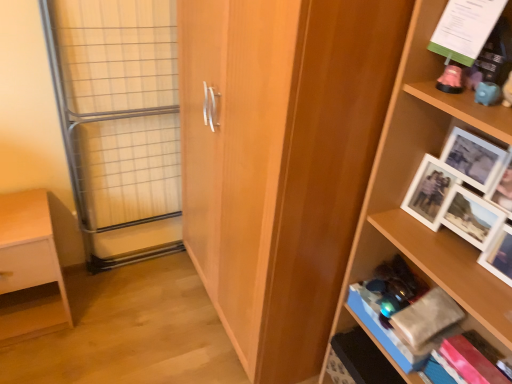
Question: From a real-world perspective, is white matte wooden shelf at lower left, acting as the first shelf starting from the left, located higher than clear glass door at left?

Choices:
 (A) no
 (B) yes

Answer: (A)

Question: Considering the relative positions of white matte wooden shelf at lower left, which is counted as the third shelf, starting from the right, and clear glass door at left in the image provided, is white matte wooden shelf at lower left, which is counted as the third shelf, starting from the right, behind clear glass door at left?

Choices:
 (A) no
 (B) yes

Answer: (B)

Question: From the image's perspective, is white matte wooden shelf at lower left, acting as the first shelf starting from the left, below clear glass door at left?

Choices:
 (A) yes
 (B) no

Answer: (A)

Question: Is white matte wooden shelf at lower left, which is counted as the third shelf, starting from the right, facing away from clear glass door at left?

Choices:
 (A) no
 (B) yes

Answer: (A)

Question: Is white matte wooden shelf at lower left, acting as the first shelf starting from the left, far away from clear glass door at left?

Choices:
 (A) yes
 (B) no

Answer: (B)

Question: Considering their positions, is clear glass door at left located in front of or behind wooden shelf at right, marked as the third shelf in a left-to-right arrangement?

Choices:
 (A) front
 (B) behind

Answer: (B)

Question: In terms of width, does clear glass door at left look wider or thinner when compared to wooden shelf at right, which ranks as the 1th shelf in right-to-left order?

Choices:
 (A) thin
 (B) wide

Answer: (A)

Question: From the image's perspective, is clear glass door at left located above or below wooden shelf at right, which ranks as the 1th shelf in right-to-left order?

Choices:
 (A) above
 (B) below

Answer: (A)

Question: Considering the positions of clear glass door at left and wooden shelf at right, marked as the third shelf in a left-to-right arrangement, in the image, is clear glass door at left bigger or smaller than wooden shelf at right, marked as the third shelf in a left-to-right arrangement,?

Choices:
 (A) big
 (B) small

Answer: (B)

Question: From the image's perspective, relative to pink plastic piggy bank at upper right, which appears as the second shelf when viewed from the right, is clear glass door at left above or below?

Choices:
 (A) above
 (B) below

Answer: (B)

Question: Considering the positions of clear glass door at left and pink plastic piggy bank at upper right, positioned as the second shelf in left-to-right order, in the image, is clear glass door at left taller or shorter than pink plastic piggy bank at upper right, positioned as the second shelf in left-to-right order,?

Choices:
 (A) tall
 (B) short

Answer: (A)

Question: Is point (103, 269) positioned closer to the camera than point (464, 99)?

Choices:
 (A) farther
 (B) closer

Answer: (A)

Question: Is clear glass door at left wider or thinner than pink plastic piggy bank at upper right, which appears as the second shelf when viewed from the right?

Choices:
 (A) wide
 (B) thin

Answer: (A)

Question: Is wooden cupboard at center inside or outside of wooden shelf at right, which ranks as the 1th shelf in right-to-left order?

Choices:
 (A) outside
 (B) inside

Answer: (A)

Question: Is wooden cupboard at center bigger or smaller than wooden shelf at right, marked as the third shelf in a left-to-right arrangement?

Choices:
 (A) small
 (B) big

Answer: (B)